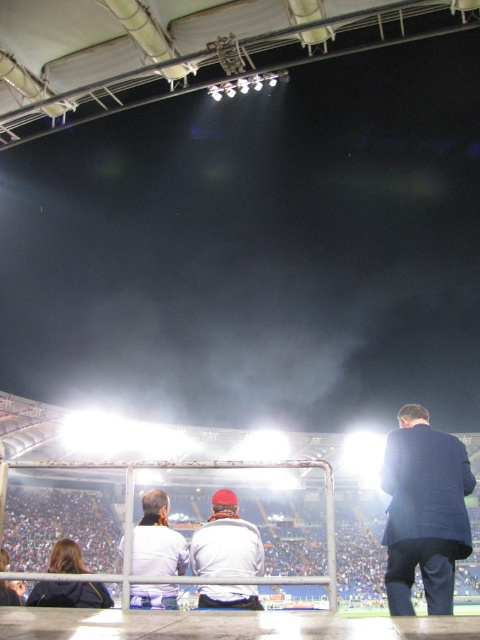
You are standing at the edge of the stadium field and want to move towards the back of the stands. Which point, point (239, 531) or point (144, 573), is closer to you as you walk towards the back?

Point (239, 531) is closer to you because it is further to the viewer than point (144, 573), meaning it is nearer to your current position as you walk towards the back of the stands.

You are a photographer trying to capture a clear image of the person wearing the white matte jacket at center and the white fabric jacket at center. However, you notice that one of the jackets is partially hiding the other. Which jacket is covering part of the other jacket?

The white matte jacket at center is positioned over white fabric jacket at center, so the white matte jacket at center is covering part of the white fabric jacket at center.

Based on the photo, you are a photographer trying to capture a photo of the dark blue suit at right and the white matte jacket at center. Based on their sizes in the image, which one would appear closer to the camera?

The dark blue suit at right is smaller than the white matte jacket at center, so the white matte jacket at center would appear closer to the camera because objects closer to the camera appear larger in the photo.